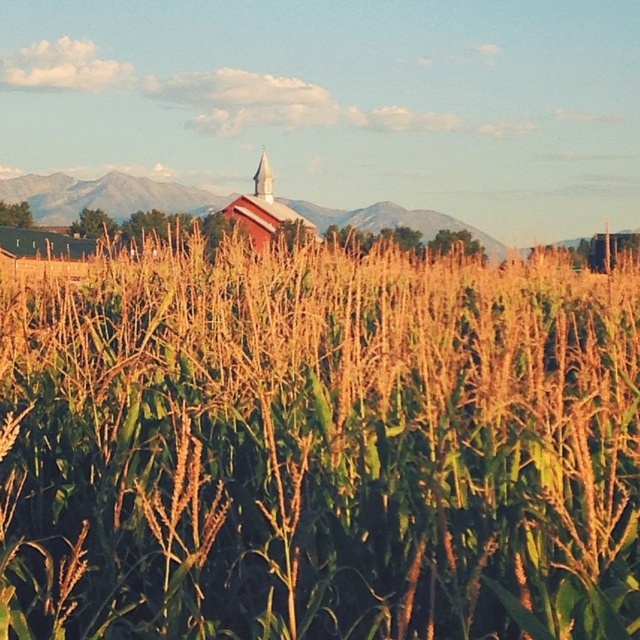
Who is higher up, green leafy corn at center or matte red barn at center?

Positioned higher is matte red barn at center.

Between green leafy corn at center and matte red barn at center, which one has more height?

Standing taller between the two is matte red barn at center.

Is point (3, 540) less distant than point (260, 188)?

Yes.

Where is `green leafy corn at center`? The image size is (640, 640). green leafy corn at center is located at coordinates (321, 449).

Does green leafy corn at center have a lesser width compared to smooth silver spire at center?

Yes, green leafy corn at center is thinner than smooth silver spire at center.

Is green leafy corn at center shorter than smooth silver spire at center?

Correct, green leafy corn at center is not as tall as smooth silver spire at center.

Is point (566, 346) positioned in front of point (256, 195)?

Yes, it is.

Identify the location of green leafy corn at center. (321, 449).

Between point (246, 224) and point (260, 160), which one is positioned behind?

Point (260, 160)

Is matte red barn at center to the left of smooth silver spire at center from the viewer's perspective?

No, matte red barn at center is not to the left of smooth silver spire at center.

Is point (266, 232) more distant than point (266, 195)?

No.

Where is `matte red barn at center`? This screenshot has height=640, width=640. matte red barn at center is located at coordinates (262, 211).